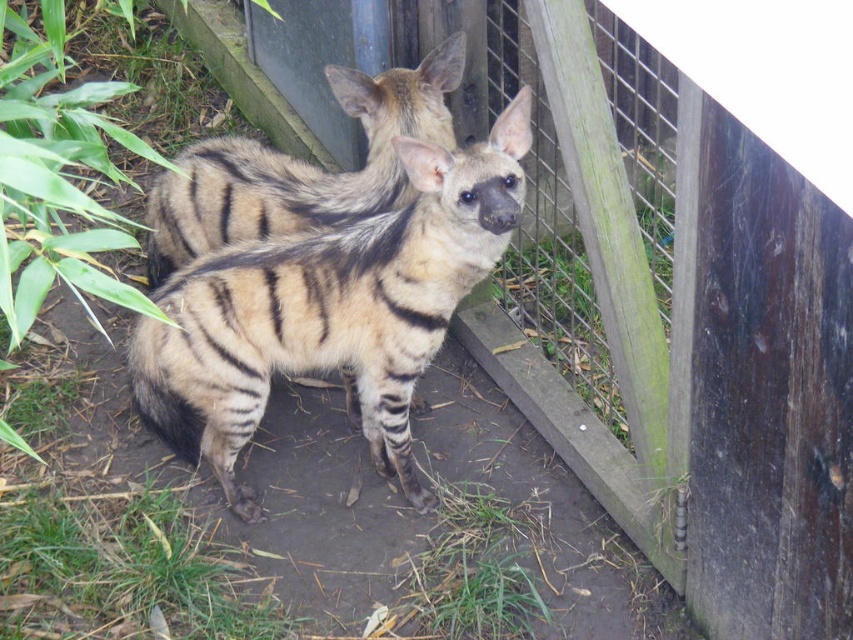
Does striped fur hyena at center have a larger size compared to black fuzzy tail at lower left?

Yes, striped fur hyena at center is bigger than black fuzzy tail at lower left.

Does striped fur hyena at center appear over black fuzzy tail at lower left?

Indeed, striped fur hyena at center is positioned over black fuzzy tail at lower left.

Where is `striped fur hyena at center`? This screenshot has height=640, width=853. striped fur hyena at center is located at coordinates (300, 168).

Is striped fur hyaena at center above black fuzzy tail at lower left?

Yes.

Is striped fur hyaena at center closer to camera compared to black fuzzy tail at lower left?

Yes, it is in front of black fuzzy tail at lower left.

Which is behind, point (146, 317) or point (167, 420)?

The point (167, 420) is behind.

At what (x,y) coordinates should I click in order to perform the action: click on striped fur hyaena at center. Please return your answer as a coordinate pair (x, y). Image resolution: width=853 pixels, height=640 pixels. Looking at the image, I should click on point(339,304).

Does wooden fence at center appear on the right side of striped fur hyaena at center?

Yes, wooden fence at center is to the right of striped fur hyaena at center.

Does wooden fence at center appear under striped fur hyaena at center?

Incorrect, wooden fence at center is not positioned below striped fur hyaena at center.

At what (x,y) coordinates should I click in order to perform the action: click on wooden fence at center. Please return your answer as a coordinate pair (x, y). This screenshot has width=853, height=640. Looking at the image, I should click on (641, 292).